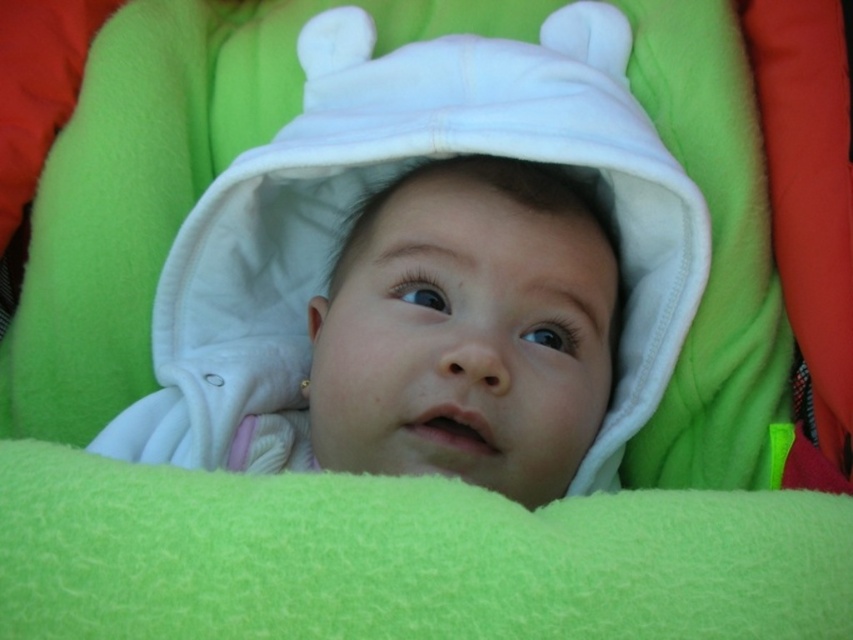
Is green fleece blanket at center positioned at the back of white fleece baby at center?

No.

Is green fleece blanket at center wider than white fleece baby at center?

Correct, the width of green fleece blanket at center exceeds that of white fleece baby at center.

Which is behind, point (746, 572) or point (543, 352)?

The point (543, 352) is more distant.

What are the coordinates of `green fleece blanket at center` in the screenshot? It's located at (403, 557).